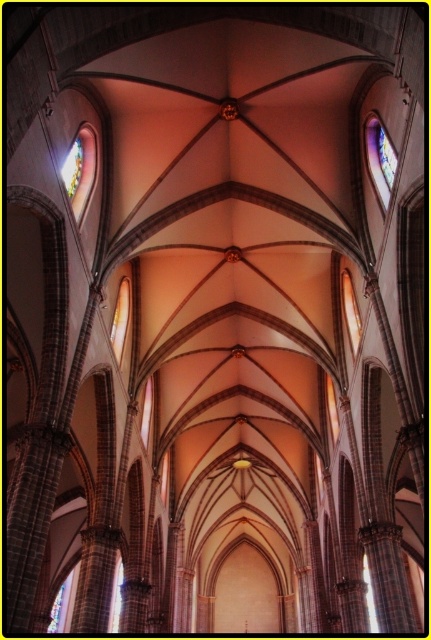
Is point (390, 177) positioned before point (81, 141)?

Yes, point (390, 177) is closer to viewer.

Between multicolored stained glass at upper right and multicolored stained glass at upper left, which one is positioned lower?

Positioned lower is multicolored stained glass at upper left.

Between point (383, 189) and point (74, 192), which one is positioned behind?

The point (383, 189) is behind.

Locate an element on the screen. The image size is (431, 640). multicolored stained glass at upper right is located at coordinates (380, 157).